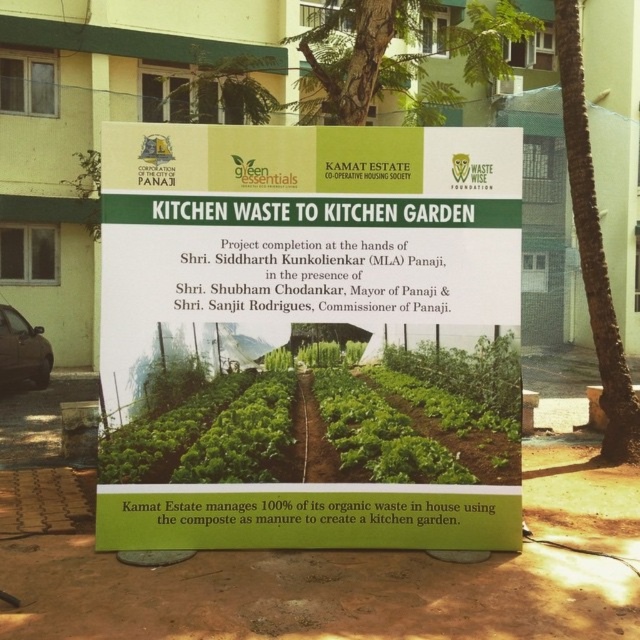
You are a visitor at the event and want to take a photo of the green leafy vegetables at center and the green leafy tree at upper center. Which object should you focus on first to ensure both are in the frame?

You should focus on the green leafy tree at upper center first because the green leafy vegetables at center is in front of it, so adjusting the focus to the tree will help capture both in the frame.

You are a gardener who wants to plant the green leafy vegetables at center and the green leafy tree at upper center in your backyard. Which one requires more space in terms of area?

The green leafy tree at upper center requires more space in terms of area since it is larger than the green leafy vegetables at center.